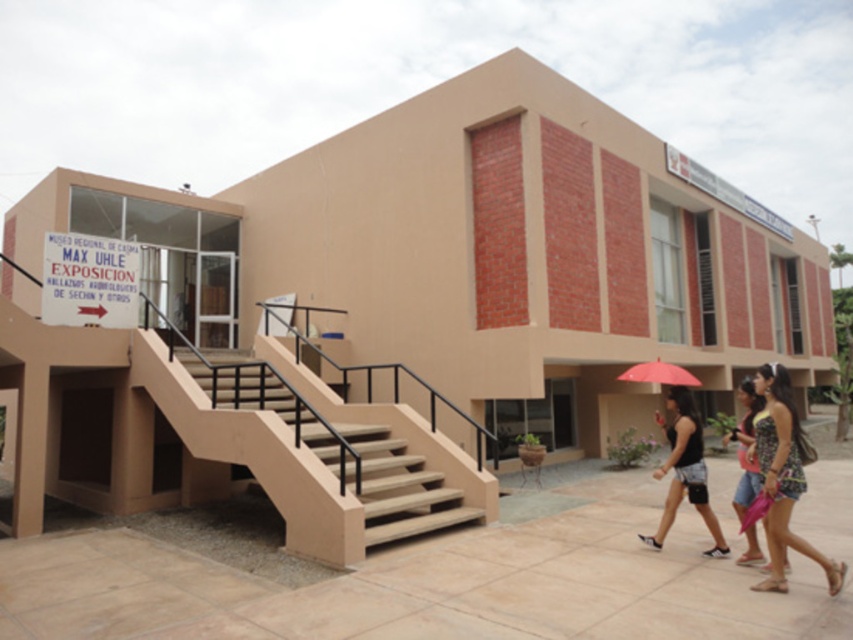
You are standing in front of the MAX UHLE EXPOSICION building and need to find the entrance. You see the beige concrete stairs at center and the white paper sign at upper left. Which object is closer to the entrance?

The beige concrete stairs at center are closer to the entrance because they are positioned to the right of the white paper sign at upper left, which is located further away from the entrance.